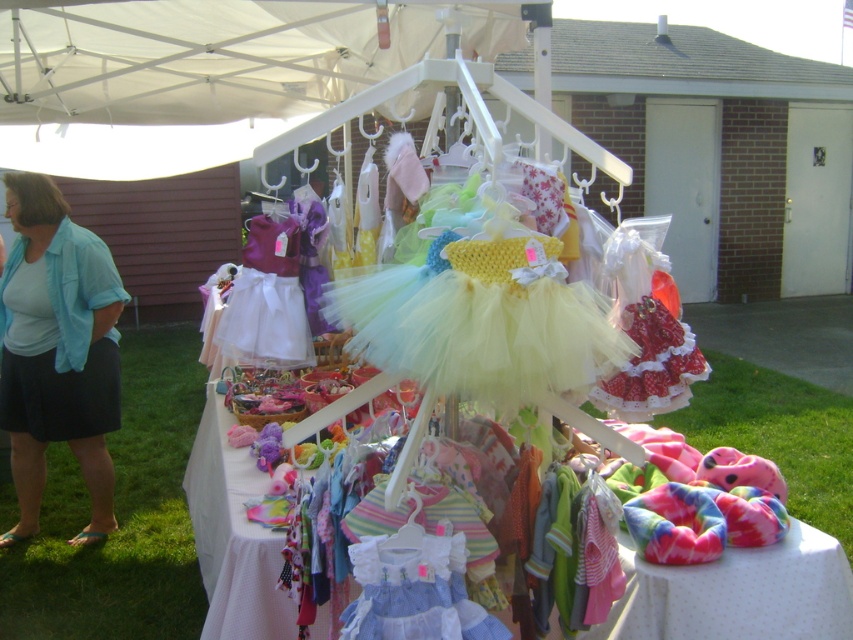
You are a customer at the market stall and want to buy both the pastel tulle dress at center and the blue cotton shirt at left. If you start from the left side of the stall, which item should you pick up first?

The blue cotton shirt at left should be picked up first since it is positioned to the left of the pastel tulle dress at center.

You are a customer at the market stall and want to determine which item is more slender between the pastel tulle dress at center and the blue cotton shirt at left. Which one is thinner?

The pastel tulle dress at center is thinner than the blue cotton shirt at left according to the description.

You are standing at the entrance of the market stall and see a point marked at coordinates (480,316). According to the image, what object is this point located on?

The point at coordinates (480,316) is located on the pastel tulle dress at center.